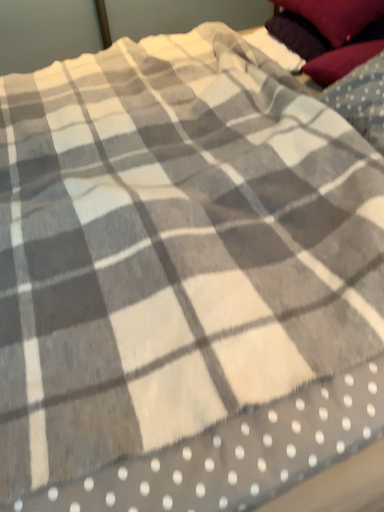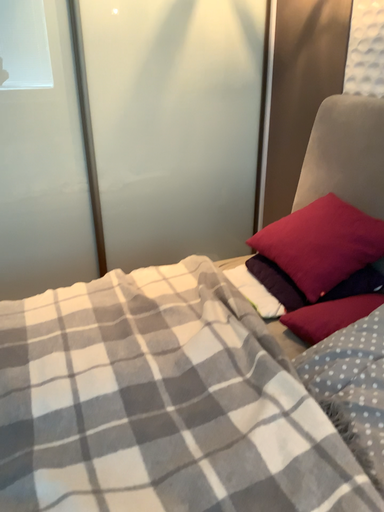
Question: Which way did the camera rotate in the video?

Choices:
 (A) rotated downward
 (B) rotated upward

Answer: (B)